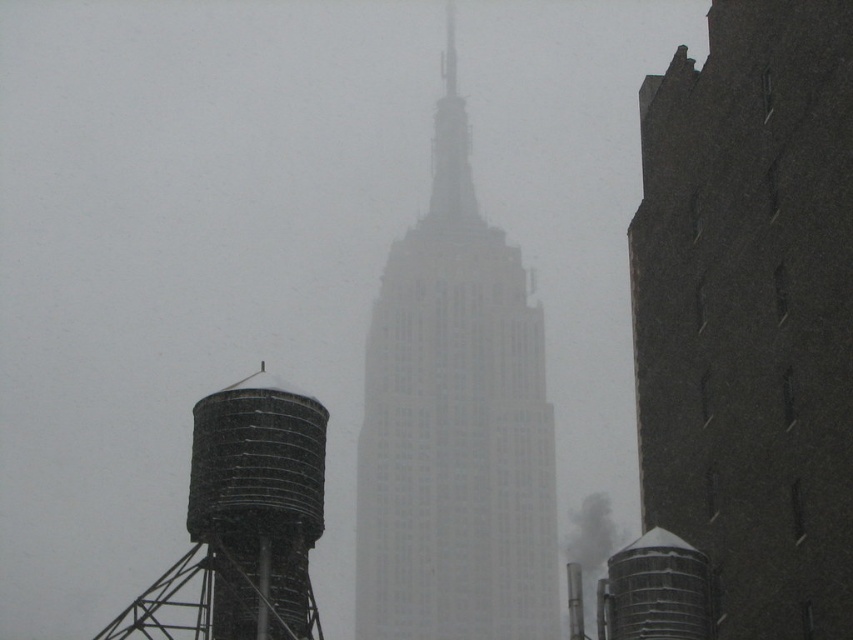
Question: Can you confirm if white glass tower at center is positioned to the left of rusty metal water tower at lower left?

Choices:
 (A) no
 (B) yes

Answer: (A)

Question: Which of the following is the farthest from the observer?

Choices:
 (A) (424, 464)
 (B) (598, 524)

Answer: (B)

Question: Is white glass tower at center to the right of rusty metal water tower at lower left from the viewer's perspective?

Choices:
 (A) no
 (B) yes

Answer: (B)

Question: Is rusty metal water tower at lower left further to the viewer compared to smokematerial/texture at center?

Choices:
 (A) no
 (B) yes

Answer: (A)

Question: Which point is closer to the camera?

Choices:
 (A) (598, 529)
 (B) (422, 570)

Answer: (B)

Question: Which point is closer to the camera taking this photo?

Choices:
 (A) (247, 420)
 (B) (532, 412)

Answer: (A)